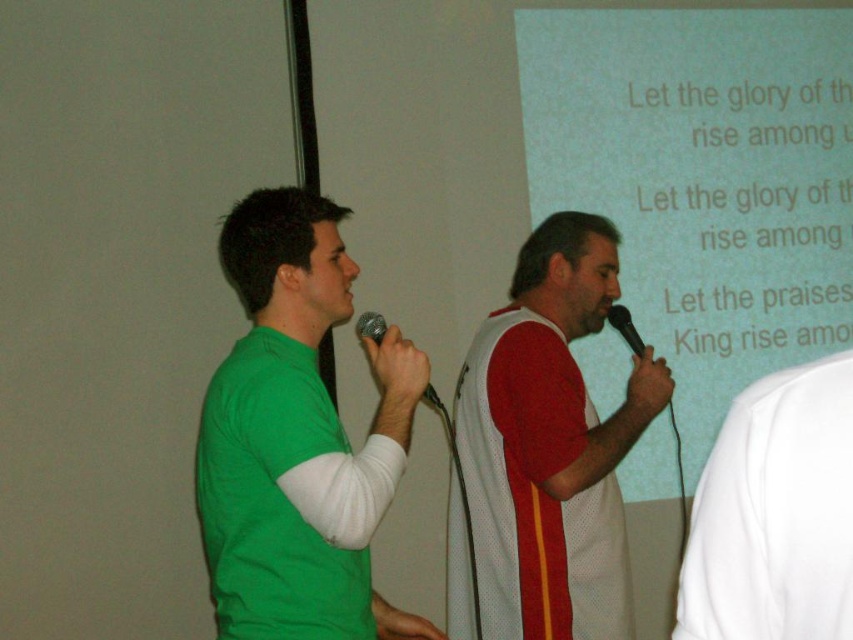
Based on the scene, which object is taller between the white matte projection screen at upper center and the metallic silver microphone at center?

The white matte projection screen at upper center is taller than the metallic silver microphone at center according to the description.

You are a stagehand who needs to adjust the projector to ensure the text on the screen is visible to the audience. The projection currently has a point at coordinates (703,179). Where exactly is this point located on the screen?

The point at coordinates (703,179) is located on the white matte projection screen at upper center.